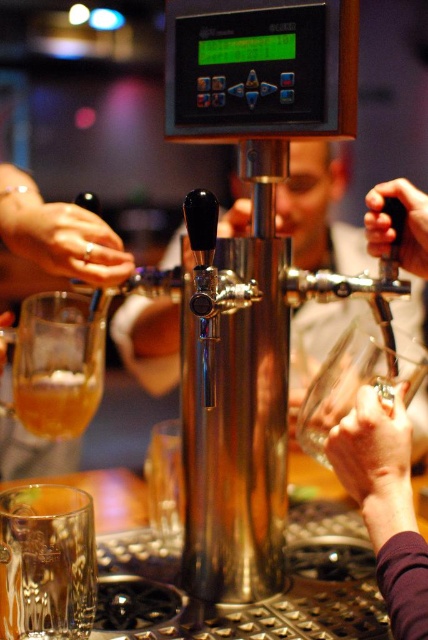
Question: Where is purple fabric hand at lower right located in relation to translucent amber glass at lower left in the image?

Choices:
 (A) right
 (B) left

Answer: (A)

Question: Which object appears farthest from the camera in this image?

Choices:
 (A) purple fabric hand at lower right
 (B) translucent amber glass at lower left

Answer: (B)

Question: Among these points, which one is nearest to the camera?

Choices:
 (A) (101, 362)
 (B) (377, 547)

Answer: (B)

Question: Which point is closer to the camera?

Choices:
 (A) translucent amber glass at lower left
 (B) purple fabric hand at lower right

Answer: (B)

Question: Considering the relative positions of purple fabric hand at lower right and translucent amber glass at lower left in the image provided, where is purple fabric hand at lower right located with respect to translucent amber glass at lower left?

Choices:
 (A) right
 (B) left

Answer: (A)

Question: Is purple fabric hand at lower right smaller than translucent amber glass at lower left?

Choices:
 (A) yes
 (B) no

Answer: (A)